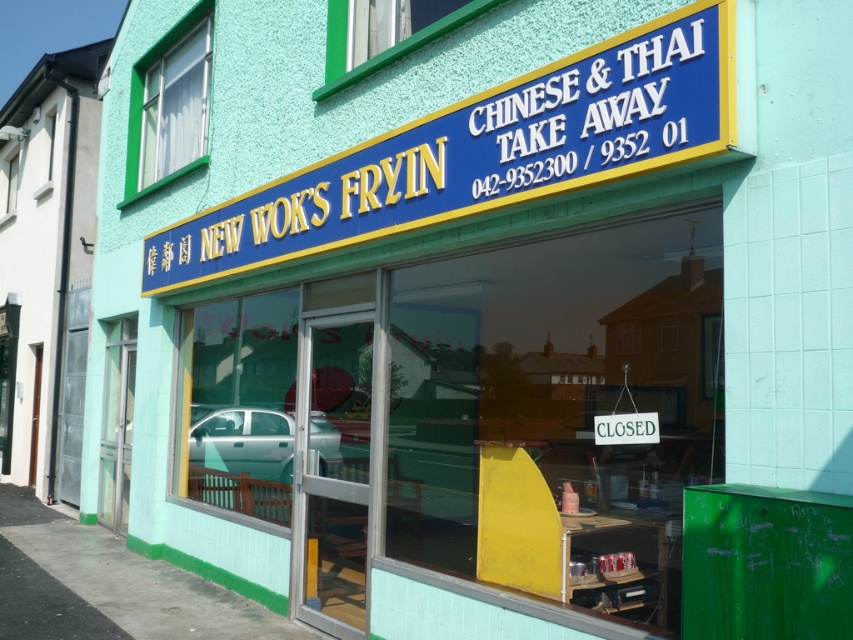
Question: Does blue plastic sign at upper center appear on the right side of teal metallic car at center?

Choices:
 (A) no
 (B) yes

Answer: (B)

Question: Can you confirm if blue plastic sign at upper center is positioned above teal metallic car at center?

Choices:
 (A) no
 (B) yes

Answer: (B)

Question: Does blue plastic sign at upper center have a smaller size compared to teal metallic car at center?

Choices:
 (A) no
 (B) yes

Answer: (A)

Question: Which point is farther from the camera taking this photo?

Choices:
 (A) (315, 435)
 (B) (375, 208)

Answer: (A)

Question: Which point is closer to the camera?

Choices:
 (A) teal metallic car at center
 (B) blue plastic sign at upper center

Answer: (B)

Question: Among these points, which one is farthest from the camera?

Choices:
 (A) [x=236, y=232]
 (B) [x=259, y=460]

Answer: (B)